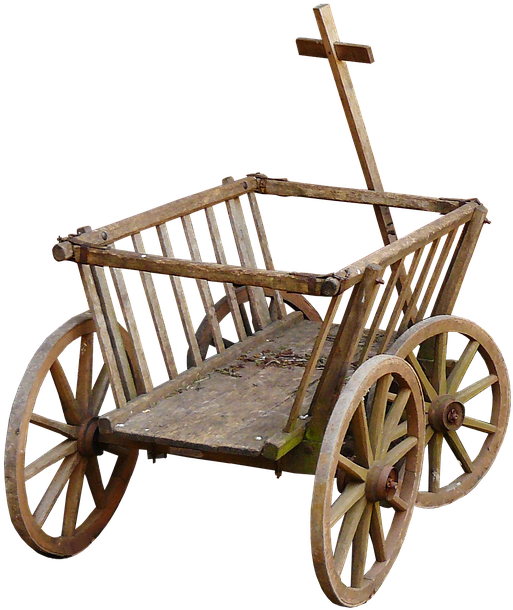
The width and height of the screenshot is (513, 610). Identify the location of screws. (153, 460), (276, 476).